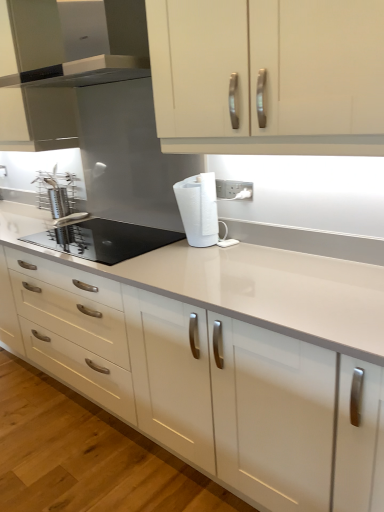
Locate an element on the screen. Image resolution: width=384 pixels, height=512 pixels. white matte paper towel at center is located at coordinates (198, 209).

The image size is (384, 512). I want to click on satin silver range hood at upper left, so click(77, 41).

Could you tell me if white glossy countertop at center is turned towards matte white cabinet at upper center, which is counted as the first cabinetry, starting from the back?

No, white glossy countertop at center is not oriented towards matte white cabinet at upper center, which is counted as the first cabinetry, starting from the back.

Is white glossy countertop at center at the left side of matte white cabinet at upper center, which appears as the first cabinetry when viewed from the left?

In fact, white glossy countertop at center is to the right of matte white cabinet at upper center, which appears as the first cabinetry when viewed from the left.

From the image's perspective, would you say white glossy countertop at center is shown under matte white cabinet at upper center, which ranks as the 2th cabinetry in right-to-left order?

Yes, from the image's perspective, white glossy countertop at center is below matte white cabinet at upper center, which ranks as the 2th cabinetry in right-to-left order.

Is white glossy countertop at center placed right next to matte white cabinet at upper center, which appears as the first cabinetry when viewed from the left?

white glossy countertop at center is not next to matte white cabinet at upper center, which appears as the first cabinetry when viewed from the left, and they're not touching.

Which of these two, satin silver range hood at upper left or black glass cooktop at center-left, is wider?

black glass cooktop at center-left is wider.

From a real-world perspective, which is physically below, satin silver range hood at upper left or black glass cooktop at center-left?

black glass cooktop at center-left.

Is satin silver range hood at upper left positioned with its back to black glass cooktop at center-left?

No, satin silver range hood at upper left's orientation is not away from black glass cooktop at center-left.

From the picture: Is white glossy cabinet doors at upper center, placed as the second cabinetry when sorted from back to front, inside matte white cabinet at upper center, which is counted as the first cabinetry, starting from the back?

No, white glossy cabinet doors at upper center, placed as the second cabinetry when sorted from back to front, is located outside of matte white cabinet at upper center, which is counted as the first cabinetry, starting from the back.

Considering the sizes of objects matte white cabinet at upper center, the second cabinetry in the front-to-back sequence, and white glossy cabinet doors at upper center, placed as the second cabinetry when sorted from back to front, in the image provided, who is wider, matte white cabinet at upper center, the second cabinetry in the front-to-back sequence, or white glossy cabinet doors at upper center, placed as the second cabinetry when sorted from back to front,?

matte white cabinet at upper center, the second cabinetry in the front-to-back sequence.

From a real-world perspective, which object stands above the other?

From a 3D spatial view, matte white cabinet at upper center, which appears as the first cabinetry when viewed from the left, is above.

Does point (43, 88) appear closer or farther from the camera than point (178, 42)?

Point (43, 88).

From the image's perspective, is white glossy cabinet doors at upper center, which is the 2th cabinetry from left to right, under matte white cabinet at upper center, which appears as the first cabinetry when viewed from the left?

Indeed, from the image's perspective, white glossy cabinet doors at upper center, which is the 2th cabinetry from left to right, is shown beneath matte white cabinet at upper center, which appears as the first cabinetry when viewed from the left.

Which is nearer, (227, 147) or (4, 34)?

Clearly, point (227, 147) is closer to the camera than point (4, 34).

Would you say white glossy cabinet doors at upper center, which is the 2th cabinetry from left to right, is inside or outside matte white cabinet at upper center, the second cabinetry in the front-to-back sequence?

white glossy cabinet doors at upper center, which is the 2th cabinetry from left to right, lies outside matte white cabinet at upper center, the second cabinetry in the front-to-back sequence.

Is white glossy cabinet doors at upper center, which is the 2th cabinetry from left to right, facing away from matte white cabinet at upper center, which appears as the first cabinetry when viewed from the left?

No, white glossy cabinet doors at upper center, which is the 2th cabinetry from left to right,'s orientation is not away from matte white cabinet at upper center, which appears as the first cabinetry when viewed from the left.

Which is closer, (198, 214) or (1, 77)?

Point (198, 214) is closer to the camera than point (1, 77).

Considering the sizes of objects white matte paper towel at center and satin silver range hood at upper left in the image provided, who is thinner, white matte paper towel at center or satin silver range hood at upper left?

white matte paper towel at center.

Based on the photo, from a real-world perspective, is white matte paper towel at center positioned under satin silver range hood at upper left based on gravity?

Yes.

From a real-world perspective, between matte white cabinet at upper center, which ranks as the 2th cabinetry in right-to-left order, and white matte paper towel at center, who is vertically higher?

In real-world perspective, matte white cabinet at upper center, which ranks as the 2th cabinetry in right-to-left order, is above.

How many degrees apart are the facing directions of matte white cabinet at upper center, which appears as the first cabinetry when viewed from the left, and white matte paper towel at center?

matte white cabinet at upper center, which appears as the first cabinetry when viewed from the left, and white matte paper towel at center are facing 0.182 degrees away from each other.

From the image's perspective, is matte white cabinet at upper center, which appears as the first cabinetry when viewed from the left, below white matte paper towel at center?

No, from the image's perspective, matte white cabinet at upper center, which appears as the first cabinetry when viewed from the left, is not beneath white matte paper towel at center.

In the scene shown: Is matte white cabinet at upper center, the second cabinetry in the front-to-back sequence, oriented away from white matte paper towel at center?

No.

Considering the positions of objects white matte paper towel at center and matte white cabinet at upper center, which appears as the first cabinetry when viewed from the left, in the image provided, who is more to the left, white matte paper towel at center or matte white cabinet at upper center, which appears as the first cabinetry when viewed from the left,?

matte white cabinet at upper center, which appears as the first cabinetry when viewed from the left, is more to the left.

There is a white matte paper towel at center. At what (x,y) coordinates should I click in order to perform the action: click on the 2nd cabinetry above it (from the image's perspective). Please return your answer as a coordinate pair (x, y). Looking at the image, I should click on (33, 79).

Which of these two, white matte paper towel at center or matte white cabinet at upper center, which appears as the first cabinetry when viewed from the left, stands shorter?

white matte paper towel at center is shorter.

From the image's perspective, count 2nd cabinetrys upward from the white glossy countertop at center and point to it. Please provide its 2D coordinates.

[(33, 79)]

I want to click on kitchen appliance on the right of satin silver range hood at upper left, so click(104, 239).

Considering their positions, is white glossy countertop at center positioned further to matte white cabinet at upper center, which is counted as the first cabinetry, starting from the back, than black glass cooktop at center-left?

The object further to matte white cabinet at upper center, which is counted as the first cabinetry, starting from the back, is white glossy countertop at center.

Looking at the image, which one is located further to satin silver range hood at upper left, white matte paper towel at center or matte white cabinet at upper center, the second cabinetry in the front-to-back sequence?

Based on the image, white matte paper towel at center appears to be further to satin silver range hood at upper left.

Looking at this image, based on their spatial positions, is matte white cabinet at upper center, which appears as the first cabinetry when viewed from the left, or satin silver range hood at upper left closer to black glass cooktop at center-left?

The object closer to black glass cooktop at center-left is matte white cabinet at upper center, which appears as the first cabinetry when viewed from the left.

Which object lies nearer to the anchor point white glossy countertop at center, white glossy cabinet doors at upper center, which appears as the 1th cabinetry when viewed from the front, or black glass cooktop at center-left?

Among the two, black glass cooktop at center-left is located nearer to white glossy countertop at center.

Looking at this image, estimate the real-world distances between objects in this image. Which object is further from white glossy countertop at center, black glass cooktop at center-left or white matte paper towel at center?

white matte paper towel at center lies further to white glossy countertop at center than the other object.

Considering their positions, is white glossy cabinet doors at upper center, the first cabinetry positioned from the right, positioned closer to black glass cooktop at center-left than matte white cabinet at upper center, which appears as the first cabinetry when viewed from the left?

matte white cabinet at upper center, which appears as the first cabinetry when viewed from the left.

Consider the image. From the image, which object appears to be nearer to matte white cabinet at upper center, the second cabinetry in the front-to-back sequence, black glass cooktop at center-left or satin silver range hood at upper left?

satin silver range hood at upper left.

Looking at the image, which one is located further to white glossy countertop at center, satin silver range hood at upper left or matte white cabinet at upper center, which ranks as the 2th cabinetry in right-to-left order?

matte white cabinet at upper center, which ranks as the 2th cabinetry in right-to-left order, lies further to white glossy countertop at center than the other object.

Find the location of a particular element. The height and width of the screenshot is (512, 384). cabinetry between white glossy countertop at center and black glass cooktop at center-left in the front-back direction is located at coordinates (268, 75).

You are a GUI agent. You are given a task and a screenshot of the screen. Output one action in this format:
    pyautogui.click(x=<x>, y=<y>)
    Task: Click on the paper towel between white glossy countertop at center and matte white cabinet at upper center, which appears as the first cabinetry when viewed from the left, along the z-axis
    The width and height of the screenshot is (384, 512).
    Given the screenshot: What is the action you would take?
    click(198, 209)

I want to click on home appliance situated between matte white cabinet at upper center, which appears as the first cabinetry when viewed from the left, and white matte paper towel at center from left to right, so click(x=77, y=41).

You are a GUI agent. You are given a task and a screenshot of the screen. Output one action in this format:
    pyautogui.click(x=<x>, y=<y>)
    Task: Click on the paper towel between white glossy countertop at center and black glass cooktop at center-left from front to back
    This screenshot has width=384, height=512.
    Given the screenshot: What is the action you would take?
    click(198, 209)